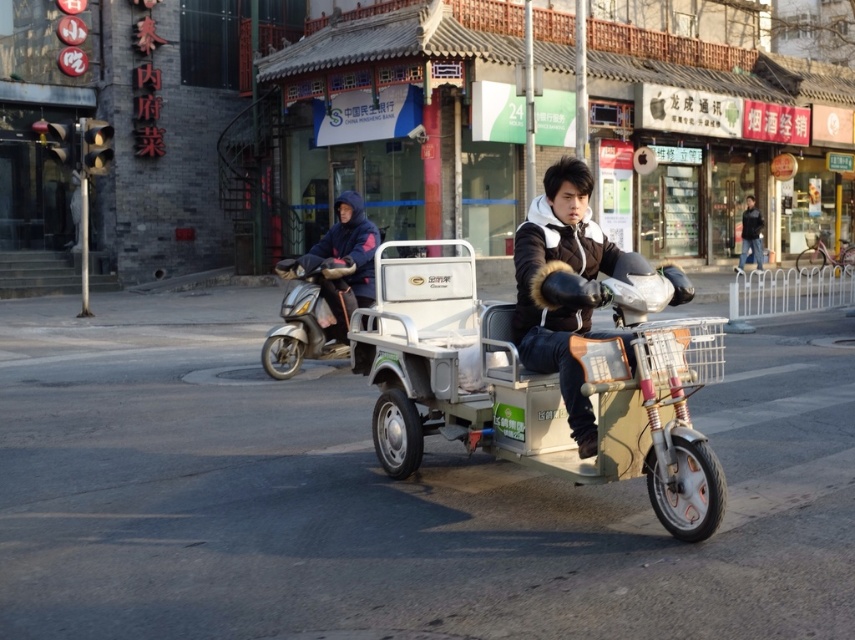
You are standing in the street scene and want to take a photo of the two points mentioned. Which point, point (569, 244) or point (370, 253), will appear larger in your camera view?

Point 0.383, 0667 is closer to the camera than point (370, 253), so it will appear larger in the camera view.

You are a delivery person who needs to deliver a package. You see a metallic silver cart at center and a black fuzzy jacket at center. Which one is closer to you?

The metallic silver cart at center and black fuzzy jacket at center are 25.19 inches apart, so the metallic silver cart at center is closer to you.